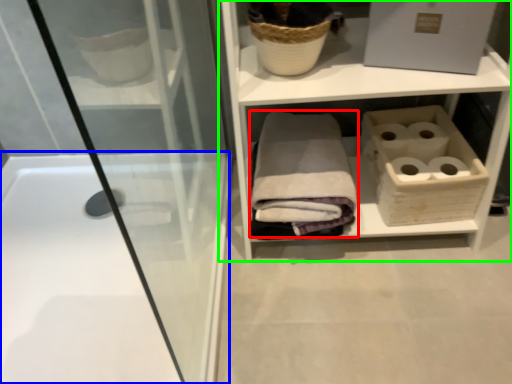
Question: Considering the real-world distances, which object is closest to bath towel (highlighted by a red box)? bathtub (highlighted by a blue box) or shelf (highlighted by a green box).

Choices:
 (A) bathtub
 (B) shelf

Answer: (B)